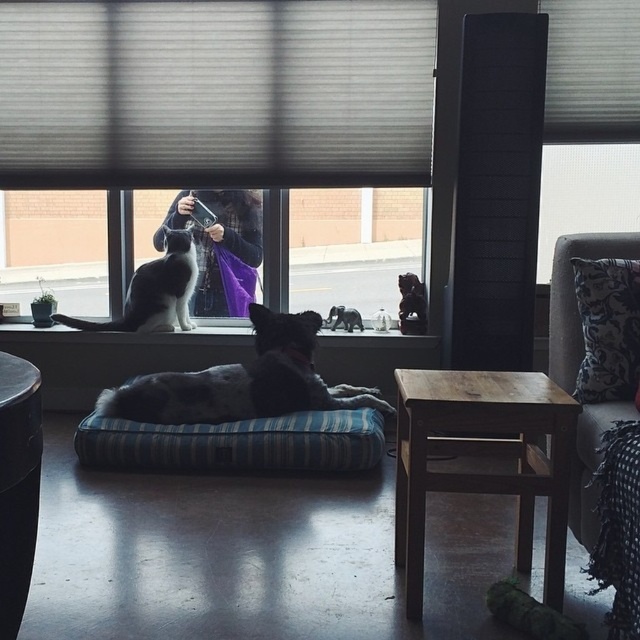
You are trying to decide whether to place a large potted plant between the transparent glass window at upper right and the black and white fur at center. Considering their sizes, will the plant fit between them?

The transparent glass window at upper right is smaller than the black and white fur at center, so there should be enough space to place the large potted plant between them.